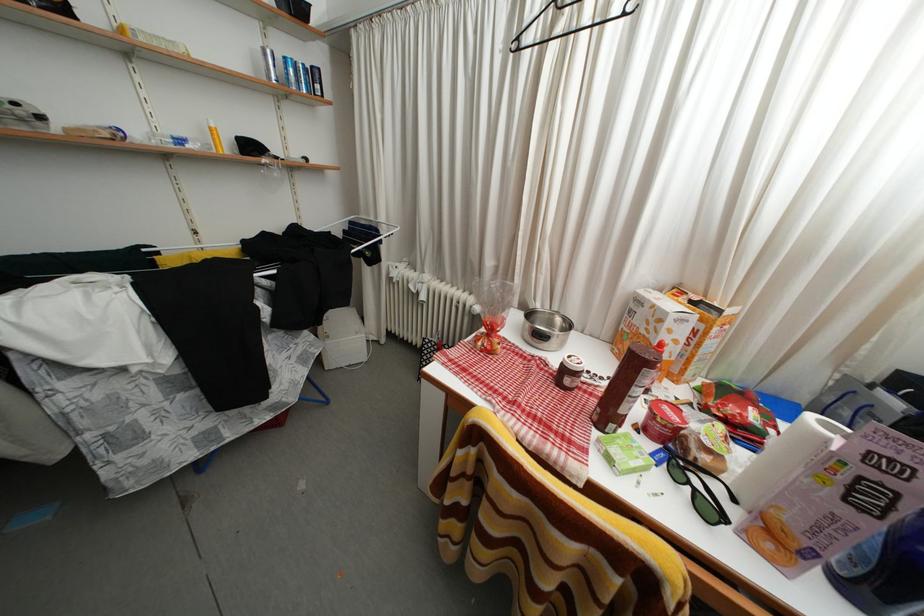
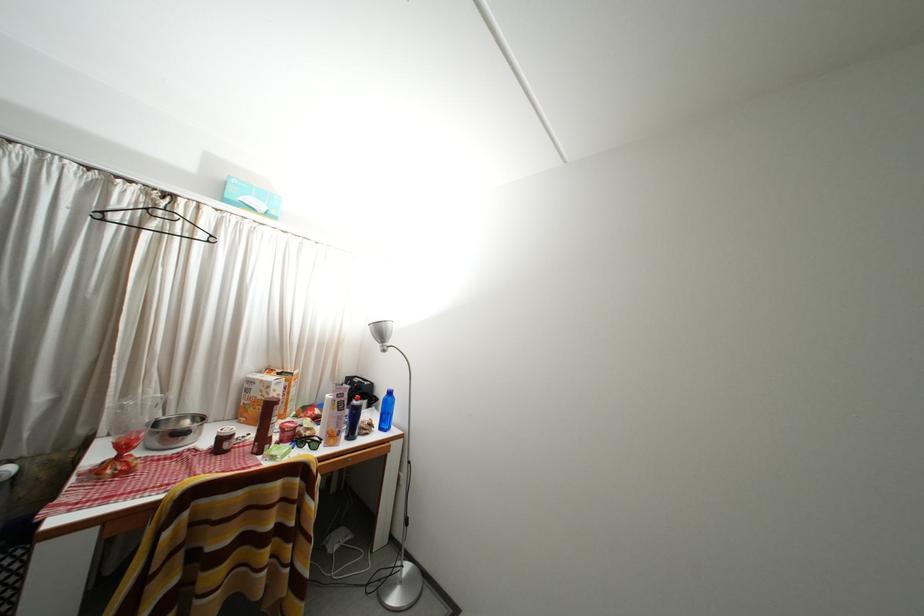
The point at (573, 376) is marked in the first image. Where is the corresponding point in the second image?

(229, 445)